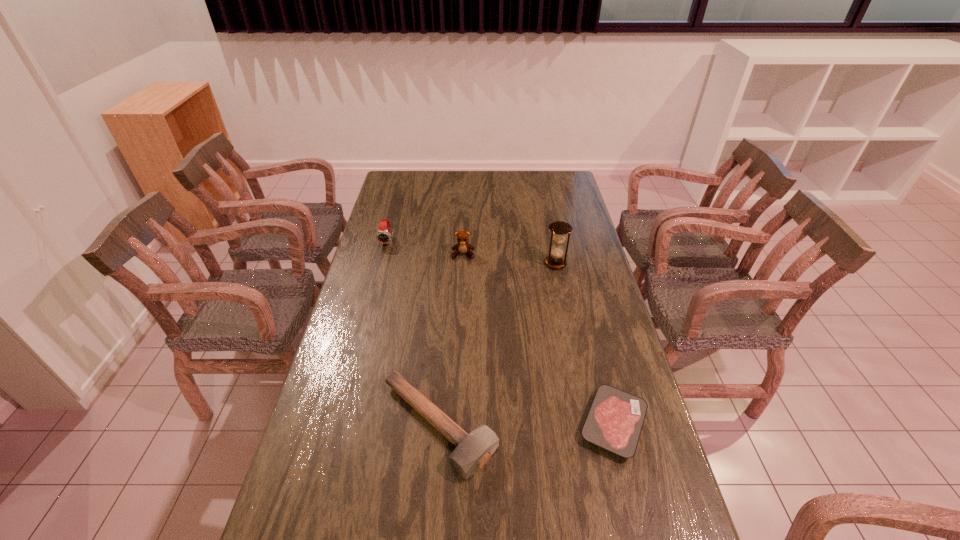
This screenshot has width=960, height=540. I want to click on the tallest object, so click(x=559, y=229).

Image resolution: width=960 pixels, height=540 pixels. Identify the location of teddy bear. (462, 246).

Where is `the leftmost object`? The width and height of the screenshot is (960, 540). the leftmost object is located at coordinates (383, 236).

Locate an element on the screen. the farthest object is located at coordinates (383, 236).

Locate an element on the screen. The image size is (960, 540). the second shortest object is located at coordinates (473, 450).

Where is `steak`? This screenshot has height=540, width=960. steak is located at coordinates (614, 422).

Locate an element on the screen. Image resolution: width=960 pixels, height=540 pixels. vacant region located 0.170m on the front of the tallest object is located at coordinates (564, 302).

This screenshot has height=540, width=960. What are the coordinates of `free point located 0.290m on the front-facing side of the teddy bear` in the screenshot? It's located at (461, 313).

The width and height of the screenshot is (960, 540). I want to click on vacant space located on the face of the leftmost object, so click(377, 281).

Where is `vacant space located 0.090m on the back of the fourth tallest object`? vacant space located 0.090m on the back of the fourth tallest object is located at coordinates (444, 355).